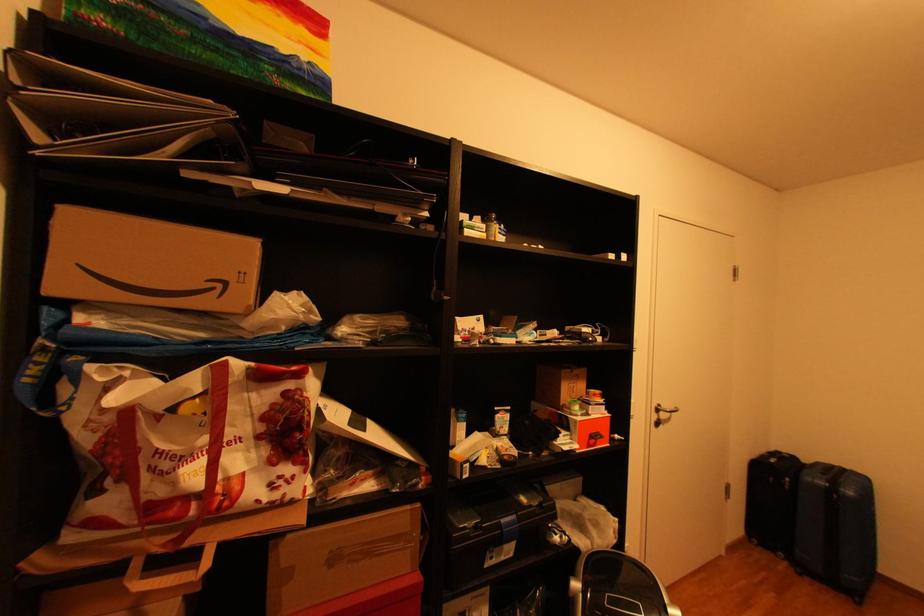
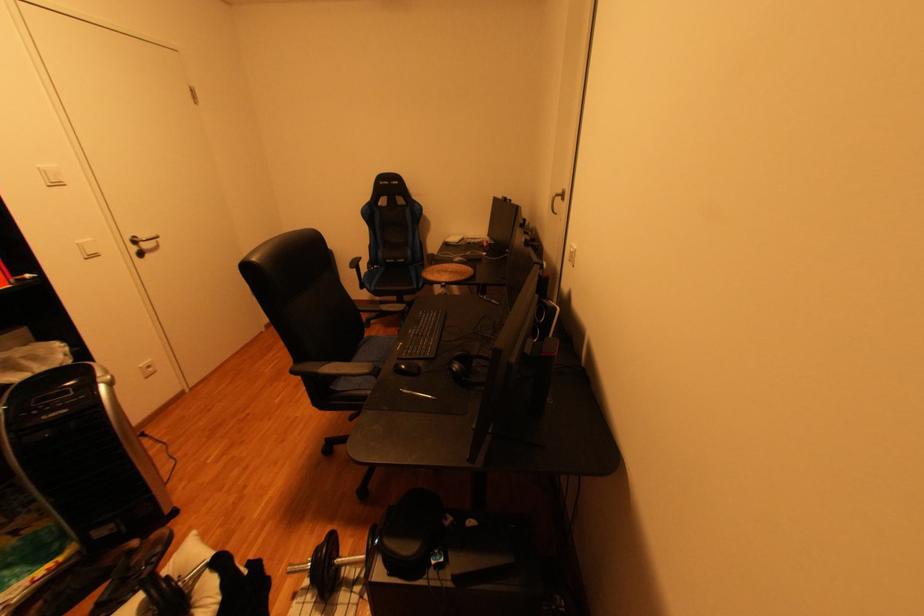
The point at (669, 416) is marked in the first image. Where is the corresponding point in the second image?

(150, 248)